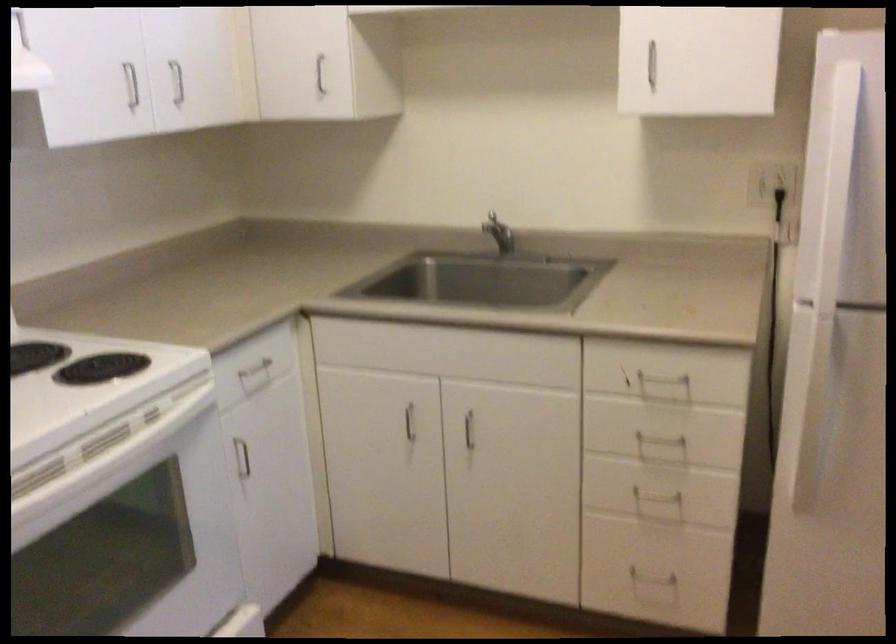
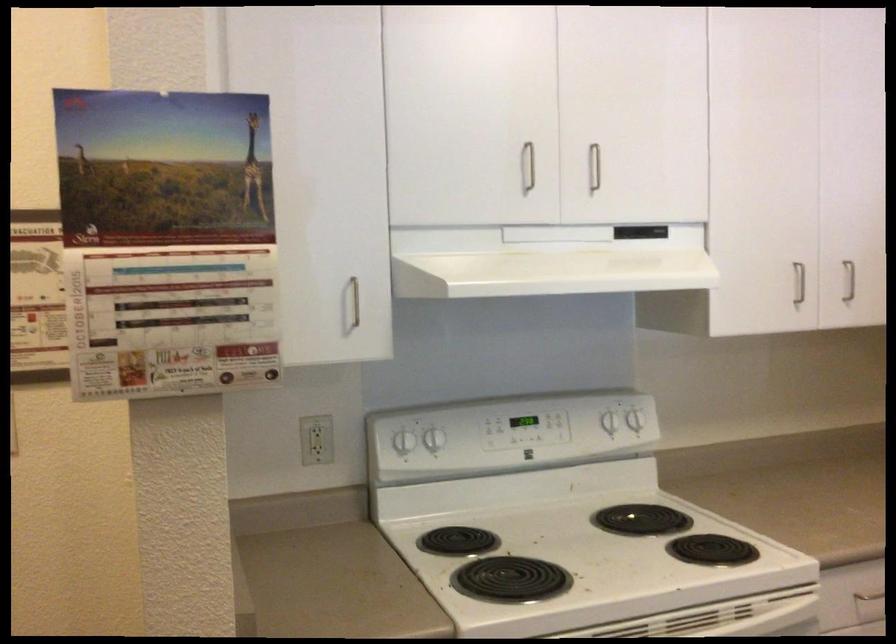
Question: The camera is either moving clockwise (left) or counter-clockwise (right) around the object. The first image is from the beginning of the video and the second image is from the end. Is the camera moving left or right when shooting the video?

Choices:
 (A) Left
 (B) Right

Answer: (B)